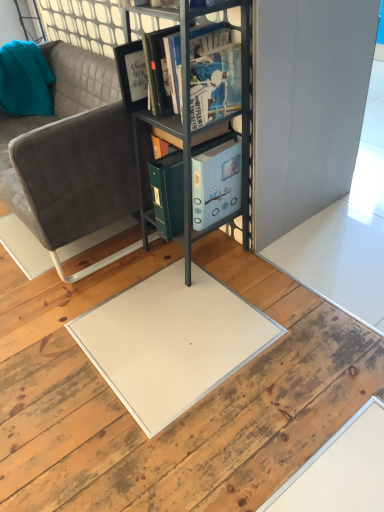
This screenshot has width=384, height=512. What do you see at coordinates (213, 74) in the screenshot? I see `matte black book at center` at bounding box center [213, 74].

Where is `teal fabric pillow at upper left`? teal fabric pillow at upper left is located at coordinates (25, 79).

Is matte black book at center situated inside metallic gray bookshelf at center or outside?

matte black book at center fits inside metallic gray bookshelf at center.

Between matte black book at center and metallic gray bookshelf at center, which one has less height?

matte black book at center.

Is matte black book at center bigger or smaller than metallic gray bookshelf at center?

Considering their sizes, matte black book at center takes up less space than metallic gray bookshelf at center.

Find the location of a particular element. The image size is (384, 512). book located behind the metallic gray bookshelf at center is located at coordinates 213,74.

Is teal fabric pillow at upper left inside the boundaries of metallic gray cabinet at center, or outside?

teal fabric pillow at upper left lies outside metallic gray cabinet at center.

Does teal fabric pillow at upper left have a smaller size compared to metallic gray cabinet at center?

Indeed, teal fabric pillow at upper left has a smaller size compared to metallic gray cabinet at center.

Is teal fabric pillow at upper left closer to camera compared to metallic gray cabinet at center?

No, it is behind metallic gray cabinet at center.

From a real-world perspective, is metallic gray bookshelf at center physically above teal fabric pillow at upper left?

No, from a real-world perspective, metallic gray bookshelf at center is not over teal fabric pillow at upper left

Considering the positions of points (127, 29) and (44, 81), is point (127, 29) farther from camera compared to point (44, 81)?

No, it is not.

Based on their sizes in the image, would you say metallic gray bookshelf at center is bigger or smaller than teal fabric pillow at upper left?

metallic gray bookshelf at center is bigger than teal fabric pillow at upper left.

From the image's perspective, does metallic gray bookshelf at center appear higher than teal fabric pillow at upper left?

No, from the image's perspective, metallic gray bookshelf at center is not over teal fabric pillow at upper left.

Is metallic gray bookshelf at center inside or outside of matte black book at center?

metallic gray bookshelf at center is outside matte black book at center.

Is metallic gray bookshelf at center facing towards matte black book at center?

Yes, metallic gray bookshelf at center faces towards matte black book at center.

From the image's perspective, is metallic gray bookshelf at center located above matte black book at center?

No, from the image's perspective, metallic gray bookshelf at center is not above matte black book at center.

Considering the sizes of objects metallic gray bookshelf at center and matte black book at center in the image provided, who is bigger, metallic gray bookshelf at center or matte black book at center?

With larger size is metallic gray bookshelf at center.

From a real-world perspective, is matte black book at center physically above teal fabric pillow at upper left?

Yes, from a real-world perspective, matte black book at center is above teal fabric pillow at upper left.

Considering the positions of objects matte black book at center and teal fabric pillow at upper left in the image provided, who is more to the left, matte black book at center or teal fabric pillow at upper left?

teal fabric pillow at upper left is more to the left.

Does matte black book at center touch teal fabric pillow at upper left?

matte black book at center is not next to teal fabric pillow at upper left, and they're not touching.

Considering the sizes of matte black book at center and teal fabric pillow at upper left in the image, is matte black book at center taller or shorter than teal fabric pillow at upper left?

Clearly, matte black book at center is shorter compared to teal fabric pillow at upper left.

Is metallic gray cabinet at center positioned beyond the bounds of teal fabric pillow at upper left?

Yes, metallic gray cabinet at center is outside of teal fabric pillow at upper left.

Considering the sizes of objects metallic gray cabinet at center and teal fabric pillow at upper left in the image provided, who is taller, metallic gray cabinet at center or teal fabric pillow at upper left?

metallic gray cabinet at center.

Is metallic gray cabinet at center oriented away from teal fabric pillow at upper left?

No, metallic gray cabinet at center is not facing away from teal fabric pillow at upper left.

Does metallic gray cabinet at center have a lesser width compared to teal fabric pillow at upper left?

No.

How different are the orientations of metallic gray cabinet at center and metallic gray bookshelf at center in degrees?

The angle between the facing direction of metallic gray cabinet at center and the facing direction of metallic gray bookshelf at center is 0.718 degrees.

Is metallic gray cabinet at center further to the viewer compared to metallic gray bookshelf at center?

Yes, it is.

Can we say metallic gray cabinet at center lies outside metallic gray bookshelf at center?

Actually, metallic gray cabinet at center is at least partially inside metallic gray bookshelf at center.

Does metallic gray cabinet at center have a smaller size compared to metallic gray bookshelf at center?

Correct, metallic gray cabinet at center occupies less space than metallic gray bookshelf at center.

Where is `book above the metallic gray bookshelf at center (from the image's perspective)`? The height and width of the screenshot is (512, 384). book above the metallic gray bookshelf at center (from the image's perspective) is located at coordinates (213, 74).

Image resolution: width=384 pixels, height=512 pixels. I want to click on cabinet located in front of the teal fabric pillow at upper left, so click(158, 128).

Looking at this image, based on their spatial positions, is teal fabric pillow at upper left or matte black book at center closer to gray fabric couch at center?

The object closer to gray fabric couch at center is teal fabric pillow at upper left.

Considering their positions, is teal fabric pillow at upper left positioned further to metallic gray cabinet at center than metallic gray bookshelf at center?

Based on the image, teal fabric pillow at upper left appears to be further to metallic gray cabinet at center.

Estimate the real-world distances between objects in this image. Which object is closer to metallic gray bookshelf at center, gray fabric couch at center or teal fabric pillow at upper left?

gray fabric couch at center is closer to metallic gray bookshelf at center.

Based on their spatial positions, is matte black book at center or teal fabric pillow at upper left closer to metallic gray bookshelf at center?

matte black book at center is positioned closer to the anchor metallic gray bookshelf at center.

From the image, which object appears to be farther from gray fabric couch at center, matte black book at center or metallic gray bookshelf at center?

matte black book at center lies further to gray fabric couch at center than the other object.

Consider the image. Based on their spatial positions, is matte black book at center or gray fabric couch at center closer to teal fabric pillow at upper left?

gray fabric couch at center is closer to teal fabric pillow at upper left.

Based on their spatial positions, is gray fabric couch at center or metallic gray cabinet at center closer to metallic gray bookshelf at center?

Among the two, metallic gray cabinet at center is located nearer to metallic gray bookshelf at center.

From the image, which object appears to be farther from metallic gray bookshelf at center, gray fabric couch at center or matte black book at center?

gray fabric couch at center.

At what (x,y) coordinates should I click in order to perform the action: click on book between teal fabric pillow at upper left and metallic gray cabinet at center in the horizontal direction. Please return your answer as a coordinate pair (x, y). This screenshot has width=384, height=512. Looking at the image, I should click on (213, 74).

Where is `shelf between gray fabric couch at center and metallic gray cabinet at center from left to right`? shelf between gray fabric couch at center and metallic gray cabinet at center from left to right is located at coordinates (198, 128).

You are a GUI agent. You are given a task and a screenshot of the screen. Output one action in this format:
    pyautogui.click(x=<x>, y=<y>)
    Task: Click on the book between gray fabric couch at center and metallic gray bookshelf at center from left to right
    
    Given the screenshot: What is the action you would take?
    pyautogui.click(x=213, y=74)

Identify the location of book between metallic gray bookshelf at center and teal fabric pillow at upper left in the front-back direction. (213, 74).